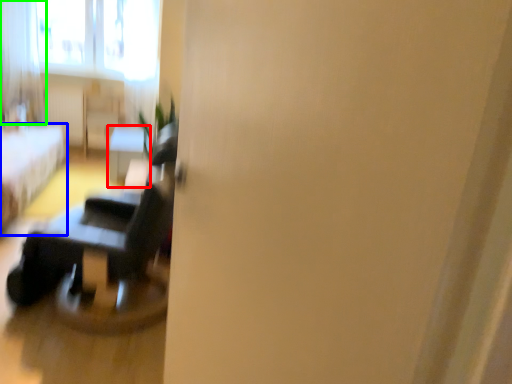
Question: Considering the real-world distances, which object is closest to table (highlighted by a red box)? furniture (highlighted by a blue box) or curtain (highlighted by a green box).

Choices:
 (A) furniture
 (B) curtain

Answer: (A)